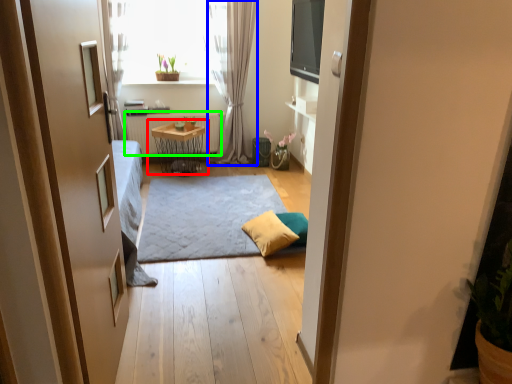
Question: Which object is positioned closest to table (highlighted by a red box)? Select from curtain (highlighted by a blue box) and radiator (highlighted by a green box).

Choices:
 (A) curtain
 (B) radiator

Answer: (B)